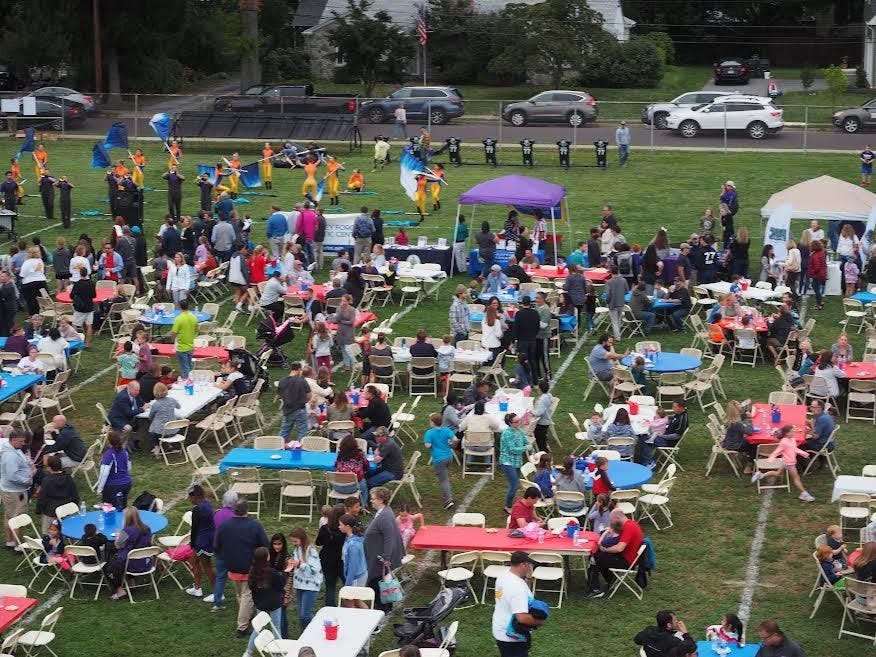
Find the location of a particular element. The width and height of the screenshot is (876, 657). 10 visibly blue tables is located at coordinates (18, 382), (95, 522), (260, 464), (634, 470), (663, 361), (865, 292), (666, 301), (161, 309), (267, 267), (745, 648).